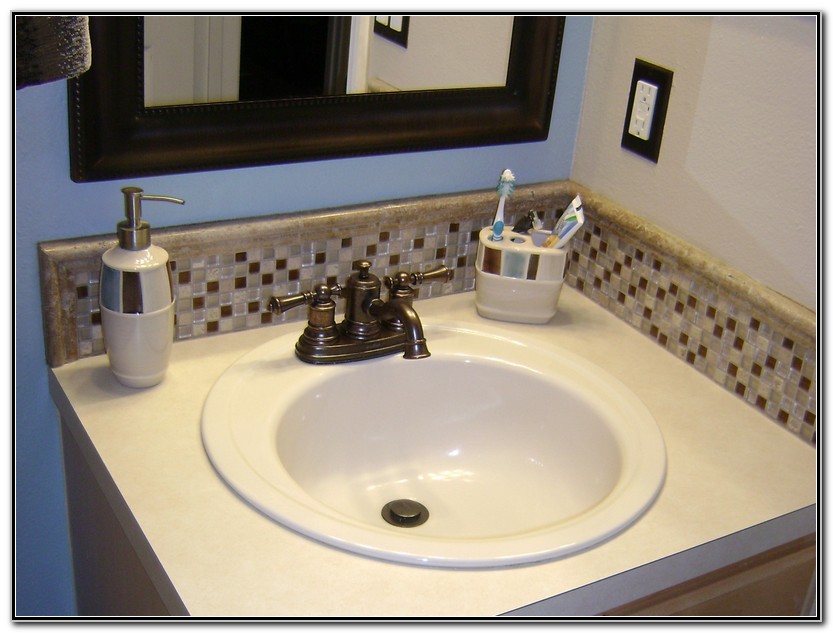
Identify the location of white countertop. The width and height of the screenshot is (833, 633). (684, 518).